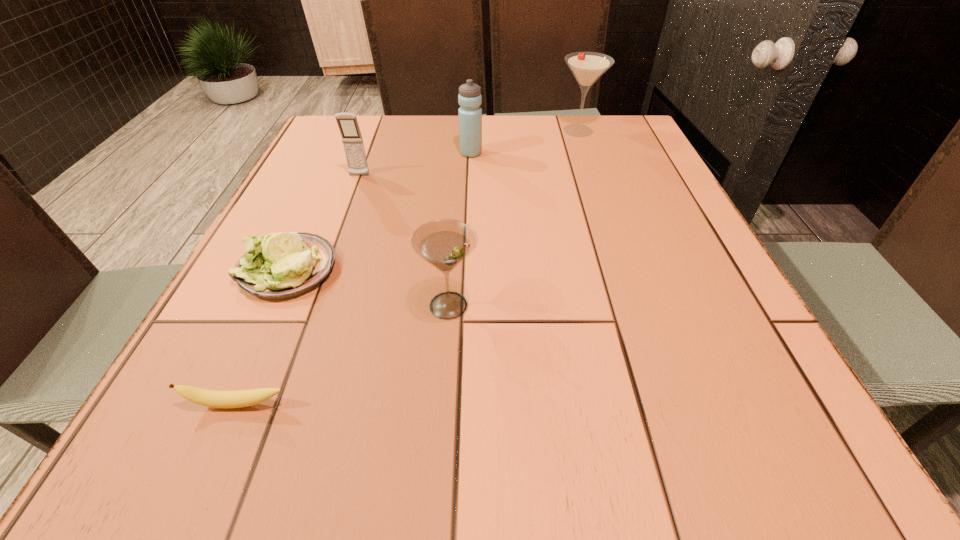
Where is `vacant region between the nearest object and the second farthest object`? vacant region between the nearest object and the second farthest object is located at coordinates (354, 279).

The height and width of the screenshot is (540, 960). In order to click on free space between the water bottle and the cellular telephone in this screenshot , I will do `click(415, 164)`.

At what (x,y) coordinates should I click in order to perform the action: click on vacant space that is in between the rightmost object and the lettuce. Please return your answer as a coordinate pair (x, y). Image resolution: width=960 pixels, height=540 pixels. Looking at the image, I should click on (433, 200).

At what (x,y) coordinates should I click in order to perform the action: click on vacant area that lies between the fifth tallest object and the shortest object. Please return your answer as a coordinate pair (x, y). The height and width of the screenshot is (540, 960). Looking at the image, I should click on (262, 337).

Identify the location of object that is the third closest to the left martini. (348, 125).

Where is `object that stands as the second closest to the shorter martini`? The width and height of the screenshot is (960, 540). object that stands as the second closest to the shorter martini is located at coordinates (211, 398).

Image resolution: width=960 pixels, height=540 pixels. I want to click on free spot that satisfies the following two spatial constraints: 1. on the back side of the rightmost object; 2. on the right side of the water bottle, so click(471, 131).